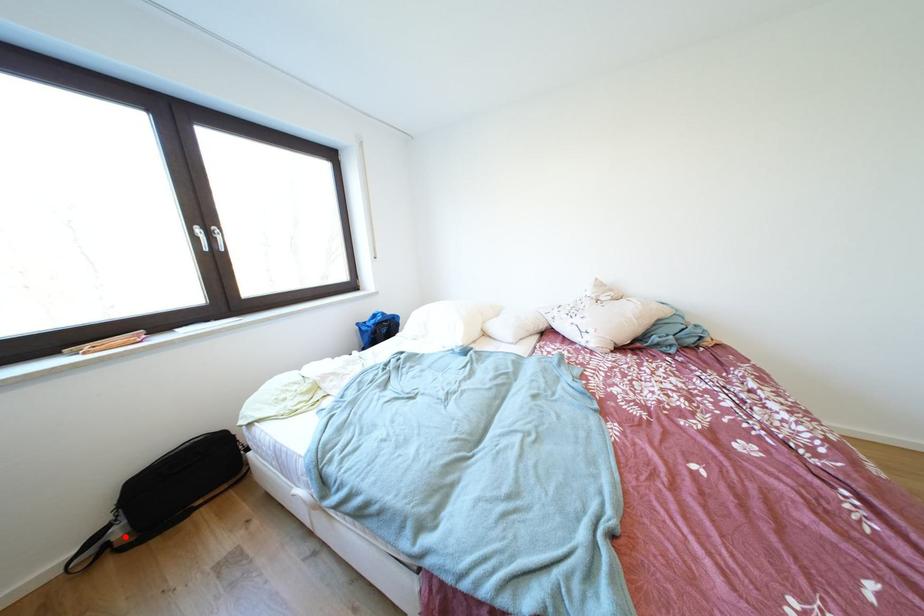
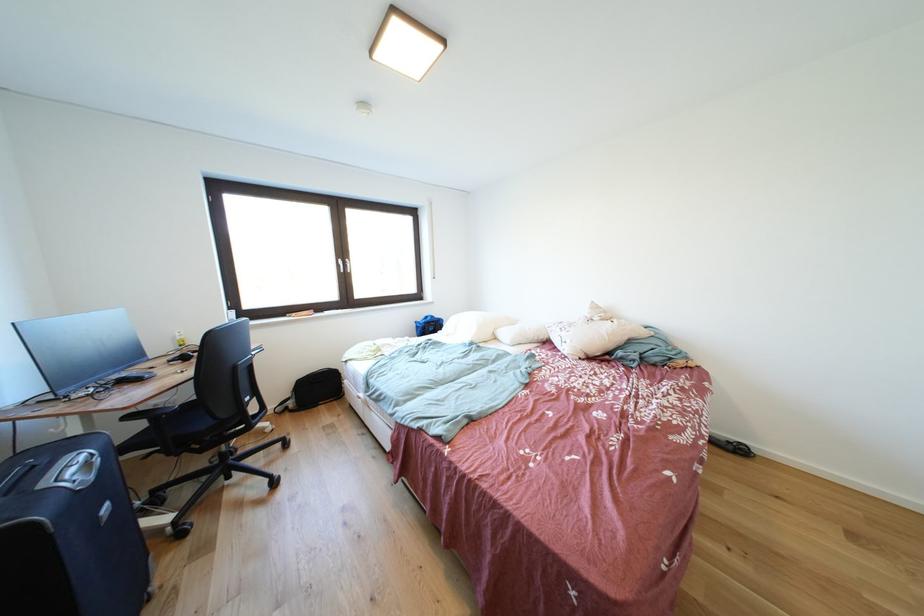
Locate, in the second image, the point that corresponds to the highlighted location in the first image.

(299, 408)